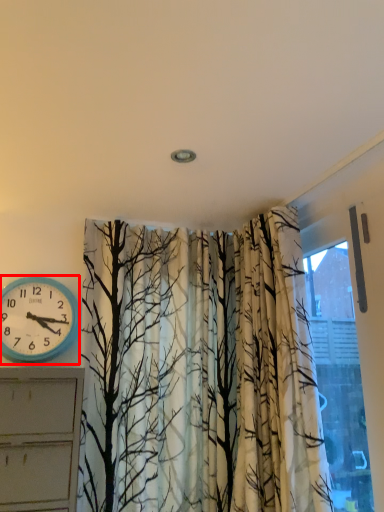
Question: Considering the relative positions of wall clock (annotated by the red box) and window in the image provided, where is wall clock (annotated by the red box) located with respect to the staircase?

Choices:
 (A) left
 (B) right

Answer: (A)